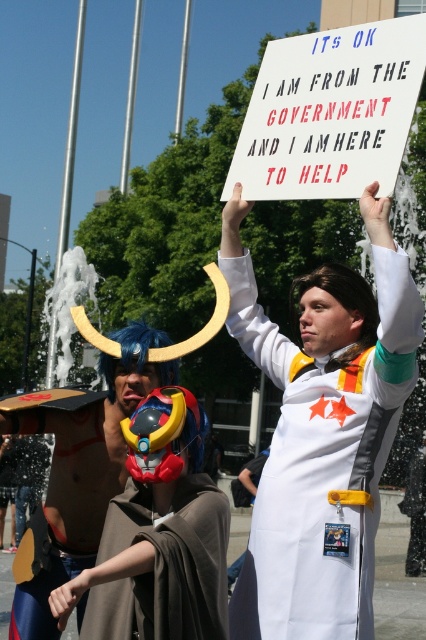
You are standing at the event and want to read the text on the white paper sign at upper center. Considering the distance, can you read it clearly without moving closer?

The white paper sign at upper center is 23.37 feet away from the camera. At that distance, it might be difficult to read the text clearly without moving closer.

You are a photographer at the event and want to capture a photo where both the white fabric coat at center and the shiny blue helmet at center are visible. Given their height difference, which object should you focus on to ensure both are in frame?

The white fabric coat at center is taller than the shiny blue helmet at center. To ensure both are in frame, focus on the white fabric coat at center as it is taller and will require more space vertically.

You are at a cosplay event and see the white fabric coat at center and the white paper sign at upper center. Which object is closer to the left edge of the image?

The white fabric coat at center is positioned on the left side of the white paper sign at upper center, so it is closer to the left edge of the image.